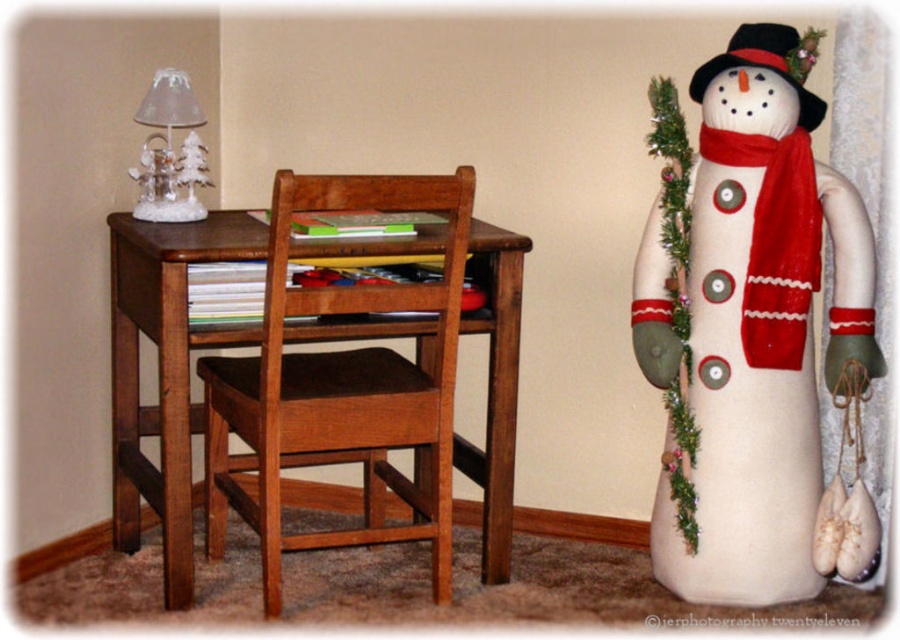
Question: Among these points, which one is nearest to the camera?

Choices:
 (A) (785, 353)
 (B) (221, 422)
 (C) (765, 294)

Answer: (C)

Question: Which point is farther to the camera?

Choices:
 (A) (172, 176)
 (B) (360, 417)
 (C) (745, 179)
 (D) (789, 173)

Answer: (A)

Question: Observing the image, what is the correct spatial positioning of wooden chair at center in reference to clear glass lampshade at upper left?

Choices:
 (A) below
 (B) above

Answer: (A)

Question: Which object is the farthest from the wooden chair at center?

Choices:
 (A) felt snowman at right
 (B) red knitted scarf at right
 (C) clear glass lampshade at upper left

Answer: (B)

Question: Is the position of red knitted scarf at right less distant than that of clear glass lampshade at upper left?

Choices:
 (A) no
 (B) yes

Answer: (B)

Question: Does wooden chair at center appear over clear glass lampshade at upper left?

Choices:
 (A) no
 (B) yes

Answer: (A)